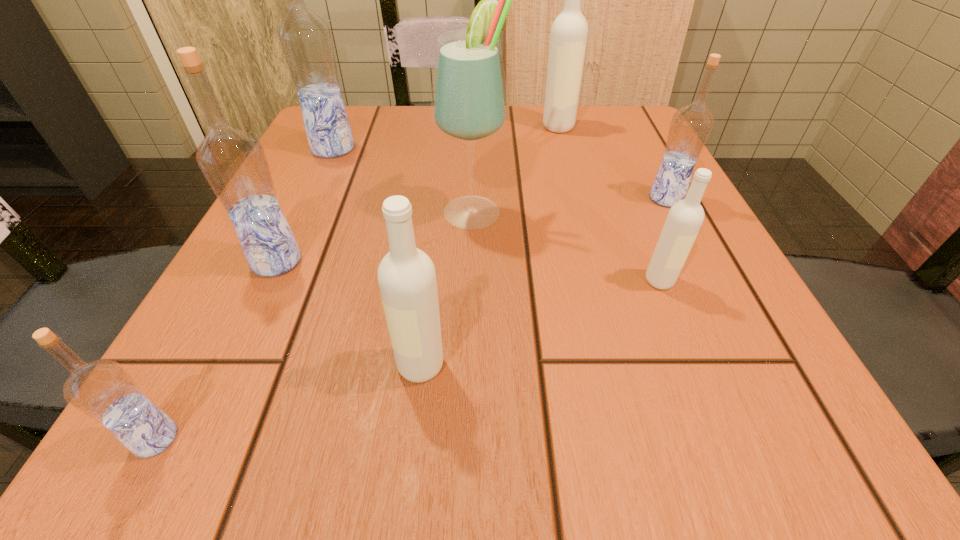
In order to click on the rightmost white vodka in this screenshot , I will do `click(684, 220)`.

Locate an element on the screen. This screenshot has height=540, width=960. the second nearest white vodka is located at coordinates (684, 220).

Where is `the nearest blue vodka`? Image resolution: width=960 pixels, height=540 pixels. the nearest blue vodka is located at coordinates (103, 390).

Locate an element on the screen. the smallest blue vodka is located at coordinates (103, 390).

The height and width of the screenshot is (540, 960). In order to click on free space located 0.050m on the back of the tallest vodka in this screenshot , I will do `click(344, 127)`.

Find the location of a particular element. This screenshot has width=960, height=540. vacant space located on the front of the alcohol is located at coordinates (472, 272).

Identify the location of free space located on the left of the farthest object. The height and width of the screenshot is (540, 960). (387, 126).

At what (x,y) coordinates should I click in order to perform the action: click on vacant space located on the front of the second nearest blue vodka. Please return your answer as a coordinate pair (x, y). Looking at the image, I should click on (242, 334).

Where is `free spot located 0.100m on the left of the second farthest blue vodka`? free spot located 0.100m on the left of the second farthest blue vodka is located at coordinates (592, 198).

Image resolution: width=960 pixels, height=540 pixels. Find the location of `free point located on the left of the leftmost white vodka`. free point located on the left of the leftmost white vodka is located at coordinates (190, 366).